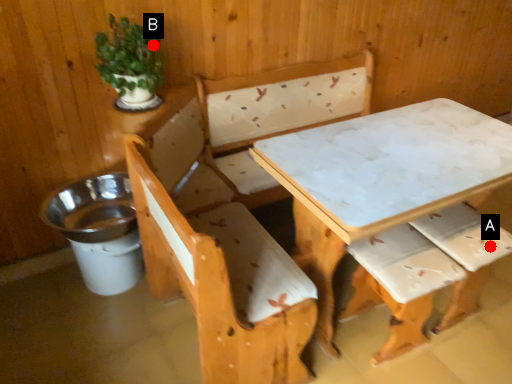
Question: Two points are circled on the image, labeled by A and B beside each circle. Which point is further to the camera?

Choices:
 (A) A is further
 (B) B is further

Answer: (A)